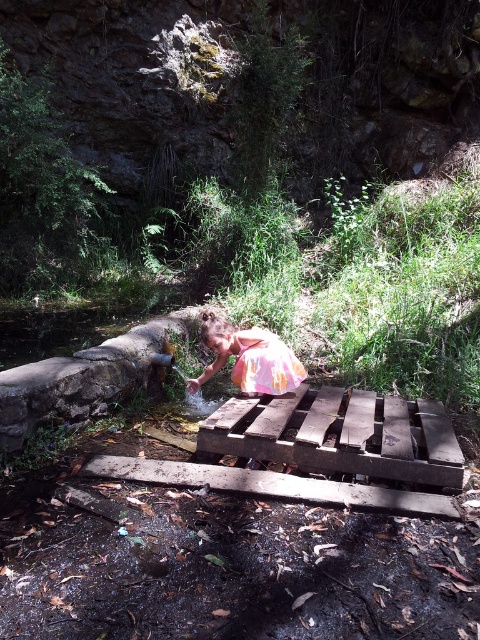
Question: Which object is the closest to the pastel floral dress at center?

Choices:
 (A) wooden plank at center
 (B) weathered brown wood at center

Answer: (B)

Question: Which point is farther to the camera?

Choices:
 (A) pastel floral dress at center
 (B) wooden plank at center

Answer: (A)

Question: Which object appears farthest from the camera in this image?

Choices:
 (A) weathered brown wood at center
 (B) wooden plank at center

Answer: (A)

Question: Does weathered brown wood at center lie in front of pastel floral dress at center?

Choices:
 (A) no
 (B) yes

Answer: (B)

Question: Considering the relative positions of wooden plank at center and pastel floral dress at center in the image provided, where is wooden plank at center located with respect to pastel floral dress at center?

Choices:
 (A) left
 (B) right

Answer: (B)

Question: Is weathered brown wood at center further to the viewer compared to pastel floral dress at center?

Choices:
 (A) no
 (B) yes

Answer: (A)